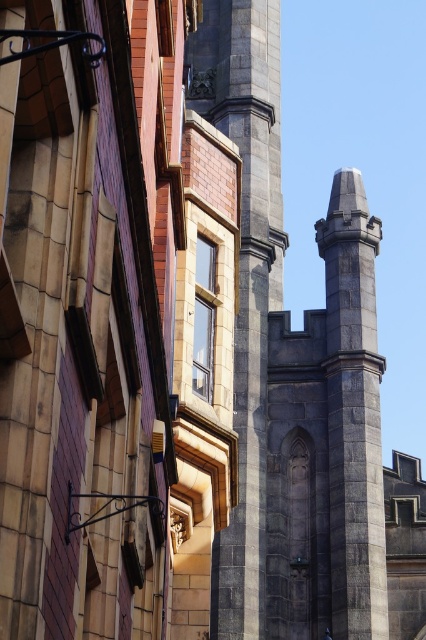
You are an architect examining the historic cityscape. You notice the gray stone tower at center and the gray stone pillar at center. Based on their positions, which one do you think is closer to the front of the image?

The gray stone tower at center is positioned over the gray stone pillar at center, meaning the tower is in front of the pillar. Therefore, the gray stone tower at center is closer to the front of the image.

You are an architect assessing a historic site. You observe the gray stone tower at center and the gray stone pillar at center. Which structure would require a deeper foundation to support its weight?

The gray stone tower at center requires a deeper foundation because it is much taller than the gray stone pillar at center, and taller structures typically need stronger and deeper foundations to ensure stability.

Consider the image. You are standing in the historic cityscape scene. You notice two points marked in the image. The first point is at coordinate (x=250, y=33) and the second is at (x=342, y=556). Which point is closer to your eyes?

Point (x=250, y=33) is closer to your eyes because it is further to the camera than point (x=342, y=556).